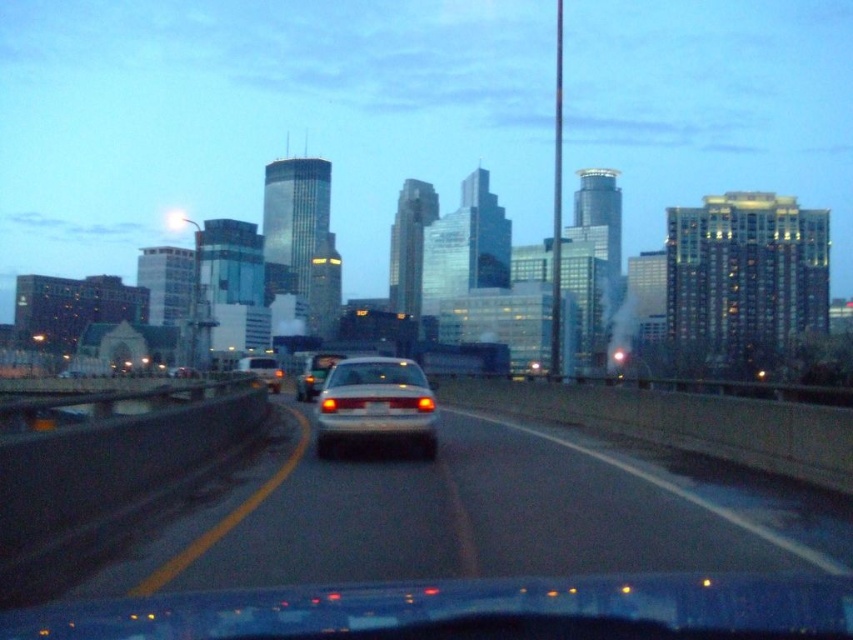
You are driving a vehicle and need to switch lanes to pass another car. You see a satin white sedan at center and a matte white van at center. Which vehicle should you avoid overtaking due to its width?

The matte white van at center is wider than the satin white sedan at center, so you should avoid overtaking the matte white van at center due to its greater width.

You are a passenger in the vehicle and want to know which of the two points, point (410, 380) or point (252, 355), is closer to you. Based on the scene description, can you determine which point is nearer?

Point (410, 380) is closer to the camera than point (252, 355), so it is nearer to you as a passenger in the vehicle.

Consider the image. You are driving a car and want to safely overtake the satin white sedan at center. Given that your car can accelerate up to 120 km per hour, and the sedan is moving at 60 km per hour, can you overtake it within the next 100 meters without violating traffic rules?

The satin white sedan at center is 13.70 meters away from the camera. Since the sedan is moving at 60 km per hour and your car can accelerate up to 120 km per hour, you can potentially overtake it within 100 meters. However, you must ensure there are no oncoming vehicles and that the road ahead is clear for a sufficient distance to complete the maneuver safely.